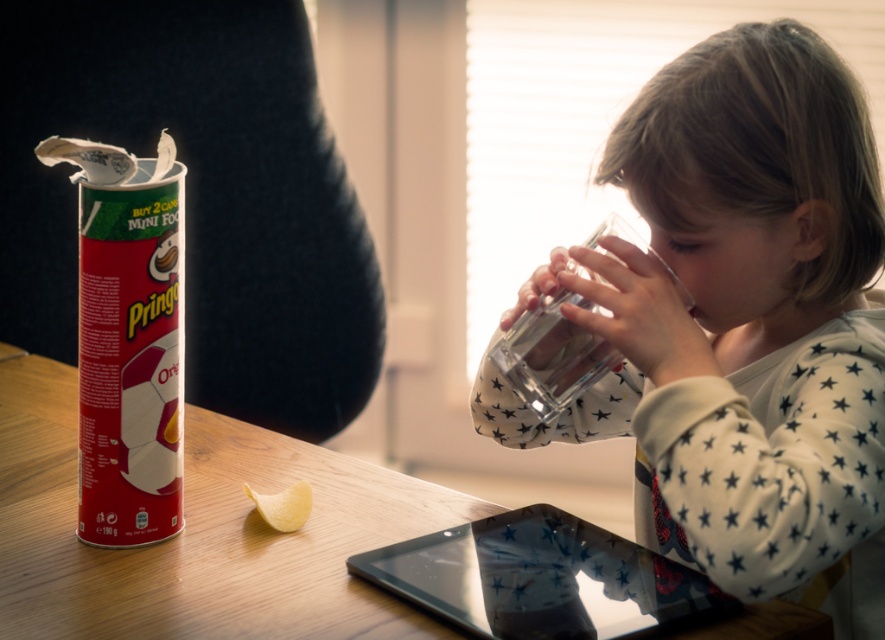
Question: Which of the following is the farthest from the observer?

Choices:
 (A) shiny metallic pringles can at left
 (B) white star-patterned shirt at upper right

Answer: (A)

Question: Observing the image, what is the correct spatial positioning of wooden table at center in reference to transparent glass tablet at lower center?

Choices:
 (A) left
 (B) right

Answer: (A)

Question: Does shiny metallic pringles can at left have a greater width compared to transparent glass tablet at lower center?

Choices:
 (A) yes
 (B) no

Answer: (B)

Question: Among these points, which one is farthest from the camera?

Choices:
 (A) (172, 208)
 (B) (829, 109)
 (C) (535, 557)

Answer: (C)

Question: Among these objects, which one is nearest to the camera?

Choices:
 (A) shiny metallic pringles can at left
 (B) white star-patterned shirt at upper right
 (C) wooden table at center
 (D) transparent glass tablet at lower center

Answer: (C)

Question: Can you confirm if wooden table at center is positioned above shiny metallic pringles can at left?

Choices:
 (A) yes
 (B) no

Answer: (B)